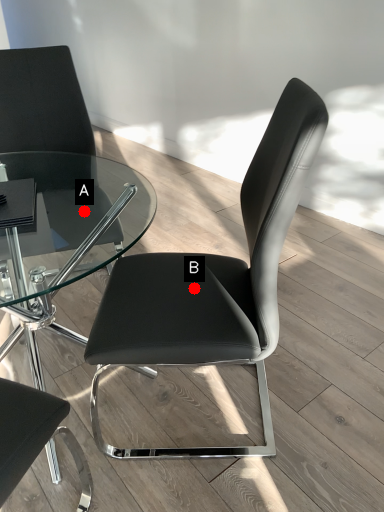
Question: Two points are circled on the image, labeled by A and B beside each circle. Among these points, which one is nearest to the camera?

Choices:
 (A) A is closer
 (B) B is closer

Answer: (B)